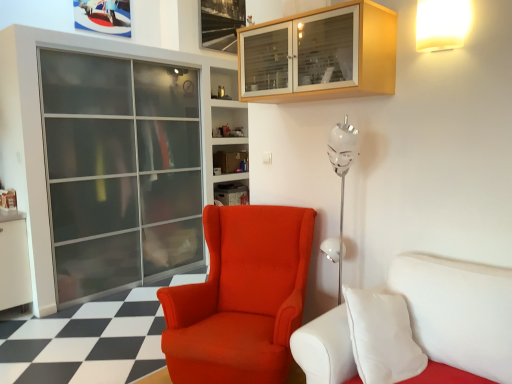
Question: Can you confirm if satin orange armchair at center is wider than wooden cabinet at upper center?

Choices:
 (A) yes
 (B) no

Answer: (A)

Question: Is satin orange armchair at center positioned far away from wooden cabinet at upper center?

Choices:
 (A) no
 (B) yes

Answer: (B)

Question: From the image's perspective, does satin orange armchair at center appear lower than wooden cabinet at upper center?

Choices:
 (A) no
 (B) yes

Answer: (B)

Question: Is satin orange armchair at center not inside wooden cabinet at upper center?

Choices:
 (A) no
 (B) yes

Answer: (B)

Question: Is satin orange armchair at center surrounding wooden cabinet at upper center?

Choices:
 (A) no
 (B) yes

Answer: (A)

Question: Can you confirm if satin orange armchair at center is bigger than wooden cabinet at upper center?

Choices:
 (A) no
 (B) yes

Answer: (B)

Question: Considering the relative sizes of transparent glass screen door at left and satin orange armchair at center in the image provided, is transparent glass screen door at left bigger than satin orange armchair at center?

Choices:
 (A) yes
 (B) no

Answer: (A)

Question: Does transparent glass screen door at left have a lesser width compared to satin orange armchair at center?

Choices:
 (A) no
 (B) yes

Answer: (B)

Question: Is satin orange armchair at center completely or partially inside transparent glass screen door at left?

Choices:
 (A) yes
 (B) no

Answer: (B)

Question: Is transparent glass screen door at left not close to satin orange armchair at center?

Choices:
 (A) yes
 (B) no

Answer: (A)

Question: Considering the relative positions of transparent glass screen door at left and satin orange armchair at center in the image provided, is transparent glass screen door at left to the left of satin orange armchair at center from the viewer's perspective?

Choices:
 (A) yes
 (B) no

Answer: (A)

Question: Can you confirm if transparent glass screen door at left is shorter than satin orange armchair at center?

Choices:
 (A) no
 (B) yes

Answer: (A)

Question: Is matte plastic shelf at center bigger than white matte wall lamp at upper right?

Choices:
 (A) no
 (B) yes

Answer: (B)